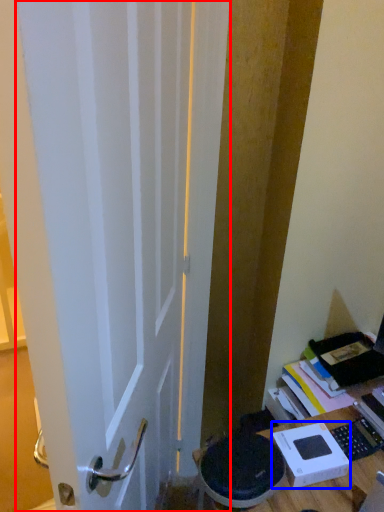
Question: Which of the following is the farthest to the observer, door (highlighted by a red box) or cardboard box (highlighted by a blue box)?

Choices:
 (A) door
 (B) cardboard box

Answer: (B)